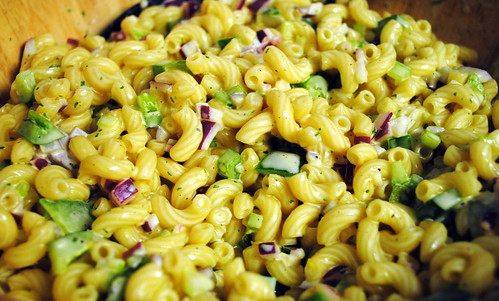
Identify the location of brown wooden bowl. (64, 22), (458, 12).